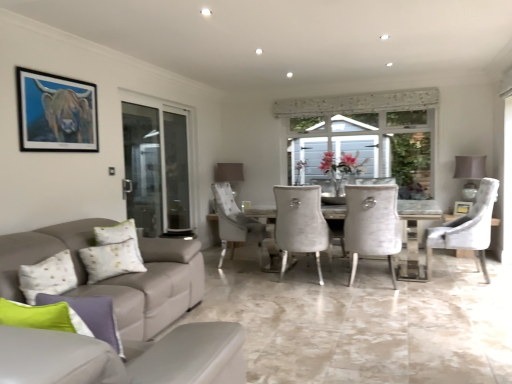
Question: Which is correct: white textured pillow at lower left, which is the 2th pillow in right-to-left order, is inside wooden picture frame at center, the 1th picture frame in the bottom-to-top sequence, or outside of it?

Choices:
 (A) inside
 (B) outside

Answer: (B)

Question: Is white textured pillow at lower left, placed as the 1th pillow when sorted from back to front, wider or thinner than wooden picture frame at center, positioned as the 2th picture frame in front-to-back order?

Choices:
 (A) thin
 (B) wide

Answer: (B)

Question: Which object is positioned farthest from the wooden picture frame at center, which is counted as the second picture frame, starting from the left?

Choices:
 (A) transparent glass screen door at left
 (B) velvet white chair at right, placed as the 1th chair when sorted from right to left
 (C) white textured pillow at lower left, which is the 2th pillow in right-to-left order
 (D) green fabric pillow at lower left, arranged as the second pillow when viewed from the left
 (E) matte gray lampshade at upper center, the first lamp from the back

Answer: (D)

Question: Estimate the real-world distances between objects in this image. Which object is closer to the light gray fabric couch at lower left?

Choices:
 (A) white fabric lampshade at right, arranged as the second lamp when viewed from the back
 (B) matte gray lampshade at upper center, arranged as the second lamp when viewed from the right
 (C) matte black frame at upper left, which appears as the second picture frame when ordered from the bottom
 (D) white textured chair at center, marked as the first chair in a left-to-right arrangement
 (E) green fabric pillow at lower left, arranged as the second pillow when viewed from the left

Answer: (C)